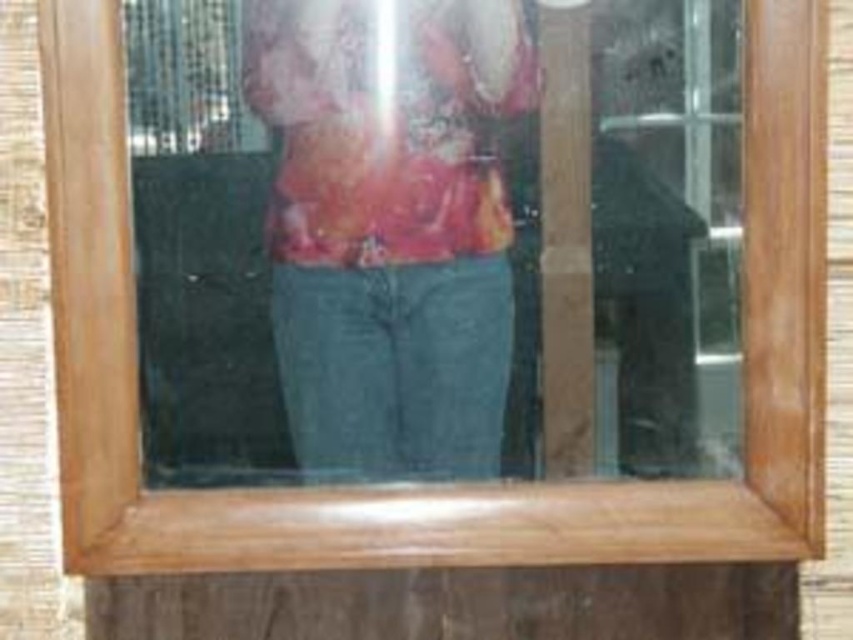
Can you confirm if matte glass mirror at center is taller than matte floral shirt at center?

→ No.

Which is in front, point (407, 364) or point (303, 253)?

Point (303, 253) is more forward.

Is point (254, 304) farther from viewer compared to point (437, 256)?

No, (254, 304) is in front of (437, 256).

Where is `matte glass mirror at center`? Image resolution: width=853 pixels, height=640 pixels. matte glass mirror at center is located at coordinates (432, 243).